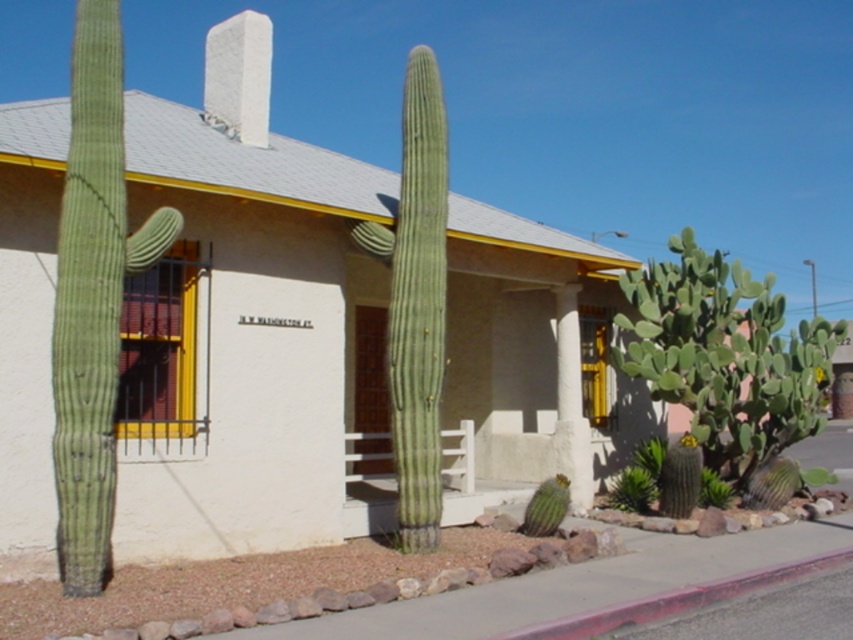
Question: Does green rough textured cactus at left appear under green matte cactus at center?

Choices:
 (A) yes
 (B) no

Answer: (A)

Question: Which point is farther to the camera?

Choices:
 (A) (97, 330)
 (B) (422, 282)

Answer: (B)

Question: Does green rough textured cactus at left have a larger size compared to green matte cactus at center?

Choices:
 (A) yes
 (B) no

Answer: (B)

Question: Can you confirm if green rough textured cactus at left is wider than green matte cactus at center?

Choices:
 (A) no
 (B) yes

Answer: (A)

Question: Which object appears closest to the camera in this image?

Choices:
 (A) green matte cactus at center
 (B) green rough textured cactus at left

Answer: (B)